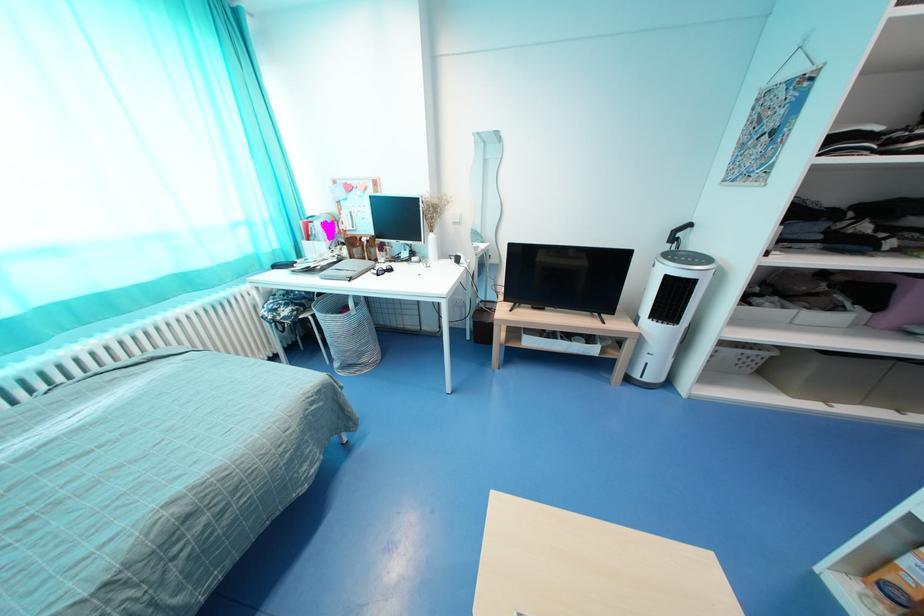
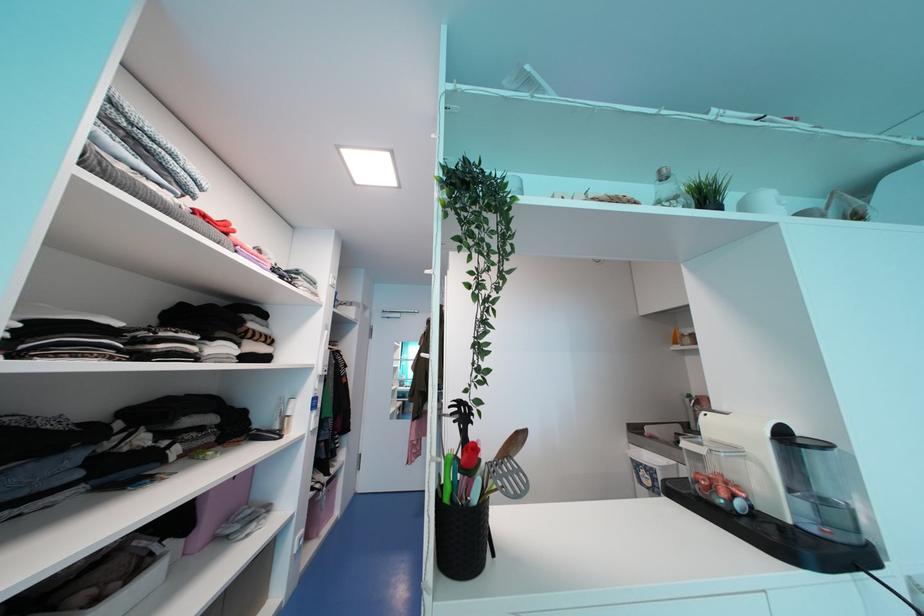
Question: Based on the continuous images, in which direction is the camera rotating? Reply with the corresponding letter.

Choices:
 (A) Left
 (B) Right
 (C) Up
 (D) Down

Answer: (B)